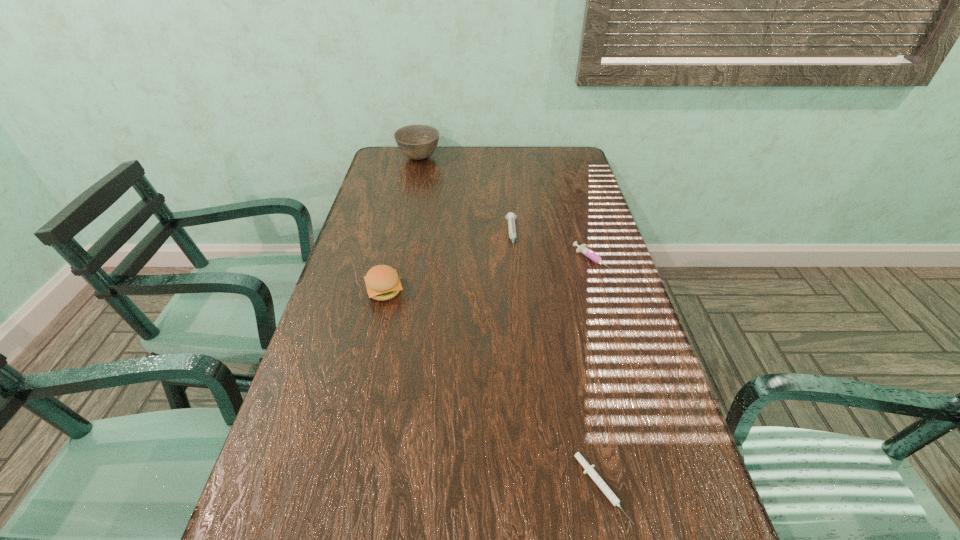
Image resolution: width=960 pixels, height=540 pixels. What are the coordinates of `free space located at the needle end of the leftmost syringe` in the screenshot? It's located at (522, 349).

Identify the location of free spot located 0.370m on the back of the rightmost syringe. This screenshot has height=540, width=960. (570, 183).

Find the location of a particular element. vacant point located 0.260m on the back of the second syringe from left to right is located at coordinates (573, 348).

What are the coordinates of `object positioned at the far edge` in the screenshot? It's located at 417,142.

Identify the location of bowl that is positioned at the left edge. The image size is (960, 540). (417, 142).

Where is `hamburger that is positioned at the left edge`? Image resolution: width=960 pixels, height=540 pixels. hamburger that is positioned at the left edge is located at coordinates (382, 281).

Locate an element on the screen. The height and width of the screenshot is (540, 960). object positioned at the far left corner is located at coordinates (417, 142).

In the image, there is a desktop. Where is `vacant space at the far edge`? vacant space at the far edge is located at coordinates (535, 157).

The height and width of the screenshot is (540, 960). I want to click on free space at the left edge of the desktop, so click(384, 303).

In the image, there is a desktop. Identify the location of free space at the right edge. (618, 288).